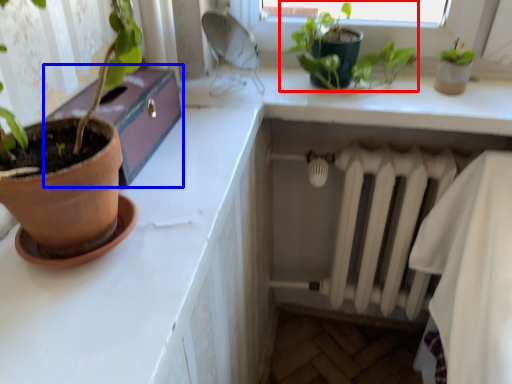
Question: Among these objects, which one is nearest to the camera, houseplant (highlighted by a red box) or window box (highlighted by a blue box)?

Choices:
 (A) houseplant
 (B) window box

Answer: (B)